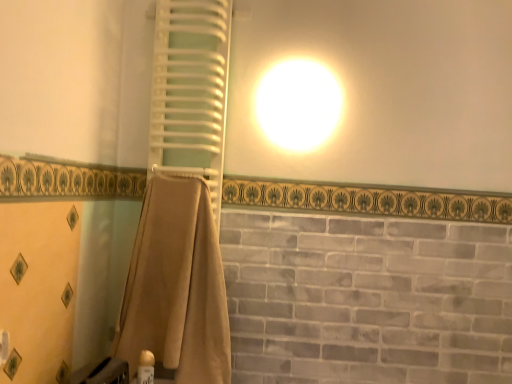
Question: In terms of height, does white plastic towel rack at upper left look taller or shorter compared to gold plastic can at lower left?

Choices:
 (A) short
 (B) tall

Answer: (B)

Question: Is white plastic towel rack at upper left situated inside gold plastic can at lower left or outside?

Choices:
 (A) inside
 (B) outside

Answer: (B)

Question: Considering the real-world distances, which object is farthest from the gold plastic can at lower left?

Choices:
 (A) white plastic towel rack at upper left
 (B) beige fabric towel at center

Answer: (A)

Question: Which of these objects is positioned closest to the gold plastic can at lower left?

Choices:
 (A) beige fabric towel at center
 (B) white plastic towel rack at upper left

Answer: (A)